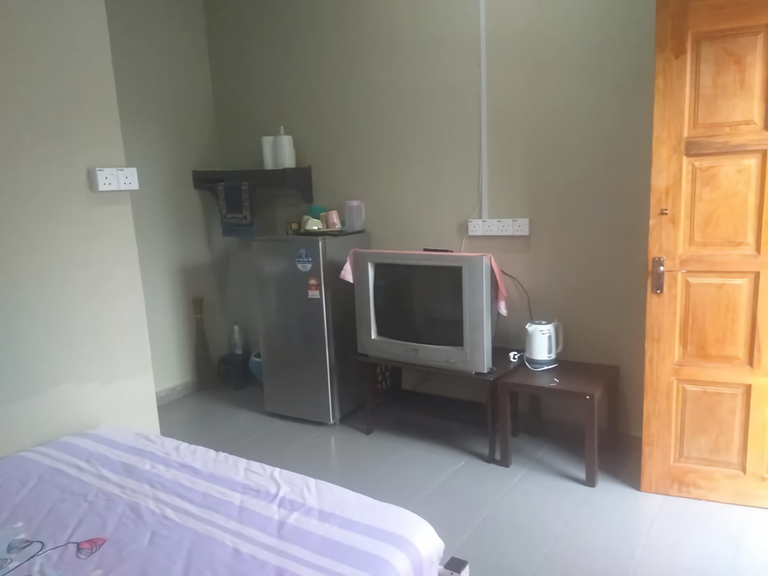
The width and height of the screenshot is (768, 576). Find the location of `bed`. bed is located at coordinates (164, 535).